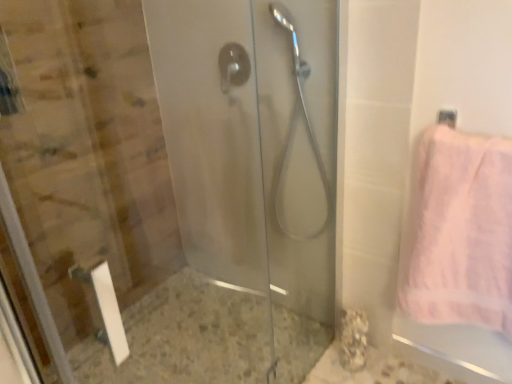
Question: Is transparent glass shower door at left thinner than satin silver shower handle at center, which ranks as the first shower in left-to-right order?

Choices:
 (A) yes
 (B) no

Answer: (B)

Question: From the image's perspective, is transparent glass shower door at left on top of satin silver shower handle at center, which ranks as the first shower in left-to-right order?

Choices:
 (A) yes
 (B) no

Answer: (B)

Question: Does transparent glass shower door at left have a smaller size compared to satin silver shower handle at center, which ranks as the first shower in left-to-right order?

Choices:
 (A) yes
 (B) no

Answer: (B)

Question: From the image's perspective, does transparent glass shower door at left appear lower than satin silver shower handle at center, placed as the second shower when sorted from right to left?

Choices:
 (A) yes
 (B) no

Answer: (A)

Question: Considering the relative positions of transparent glass shower door at left and satin silver shower handle at center, which ranks as the first shower in left-to-right order, in the image provided, is transparent glass shower door at left to the right of satin silver shower handle at center, which ranks as the first shower in left-to-right order, from the viewer's perspective?

Choices:
 (A) no
 (B) yes

Answer: (B)

Question: From a real-world perspective, does transparent glass shower door at left sit lower than satin silver shower handle at center, which ranks as the first shower in left-to-right order?

Choices:
 (A) yes
 (B) no

Answer: (A)

Question: Does satin silver shower handle at center, which ranks as the first shower in left-to-right order, turn towards transparent glass shower door at left?

Choices:
 (A) no
 (B) yes

Answer: (A)

Question: Is satin silver shower handle at center, placed as the second shower when sorted from right to left, bigger than transparent glass shower door at left?

Choices:
 (A) yes
 (B) no

Answer: (B)

Question: Is satin silver shower handle at center, placed as the second shower when sorted from right to left, shorter than transparent glass shower door at left?

Choices:
 (A) no
 (B) yes

Answer: (B)

Question: Does satin silver shower handle at center, which ranks as the first shower in left-to-right order, have a greater width compared to transparent glass shower door at left?

Choices:
 (A) yes
 (B) no

Answer: (B)

Question: From the image's perspective, would you say satin silver shower handle at center, which ranks as the first shower in left-to-right order, is positioned over transparent glass shower door at left?

Choices:
 (A) no
 (B) yes

Answer: (B)

Question: Does satin silver shower handle at center, placed as the second shower when sorted from right to left, appear on the right side of transparent glass shower door at left?

Choices:
 (A) yes
 (B) no

Answer: (B)

Question: Is the depth of pink fluffy towel at right less than that of satin silver shower handle at center, which ranks as the first shower in left-to-right order?

Choices:
 (A) no
 (B) yes

Answer: (B)